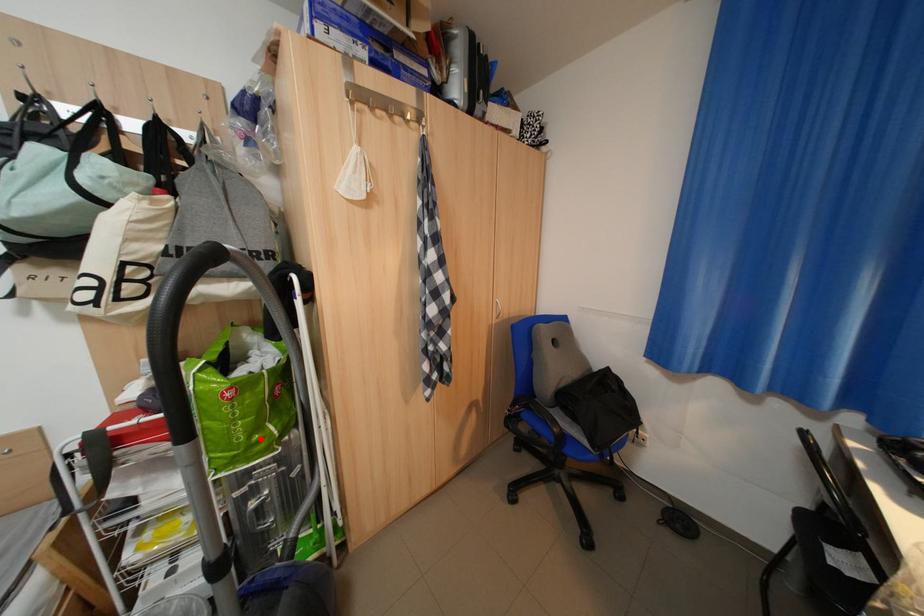
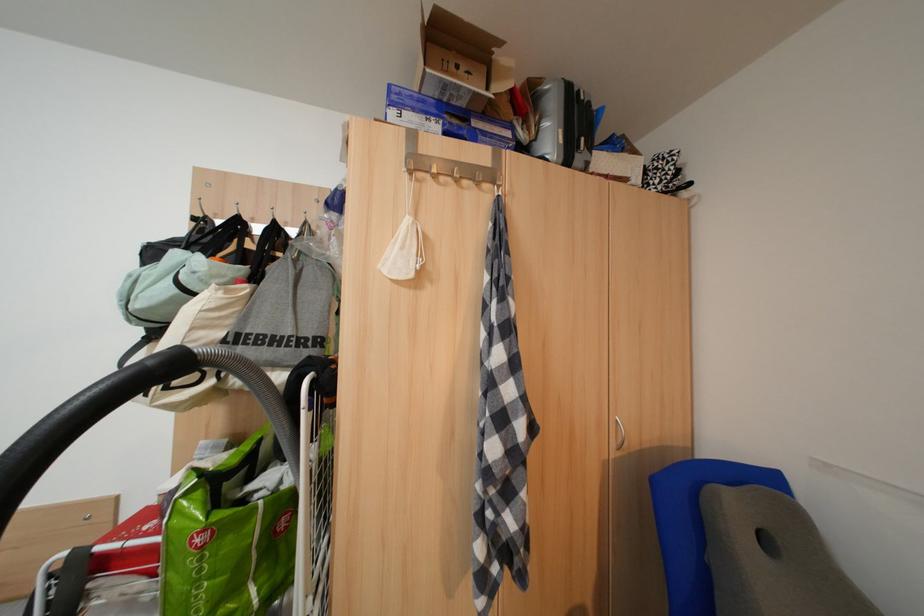
Question: I am providing you with two images of the same scene from different viewpoints. Given a red point in image1, look at the same physical point in image2. Is it:

Choices:
 (A) Closer to the viewpoint
 (B) Farther from the viewpoint

Answer: (A)